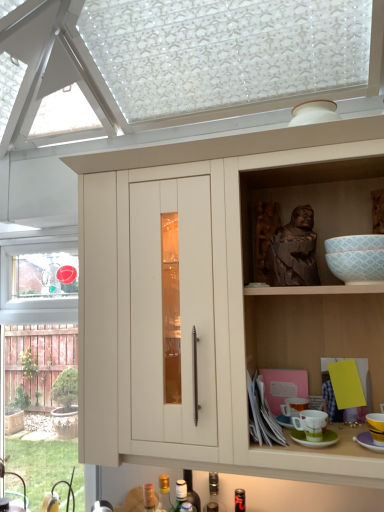
Question: Is yellow matte cup at lower right, the 2th tableware when ordered from left to right, positioned in front of matte ceramic mug at lower right, marked as the first tableware in a left-to-right arrangement?

Choices:
 (A) no
 (B) yes

Answer: (B)

Question: Is yellow matte cup at lower right, the 2th tableware when ordered from left to right, far from matte ceramic mug at lower right, marked as the first tableware in a left-to-right arrangement?

Choices:
 (A) yes
 (B) no

Answer: (B)

Question: Would you say matte ceramic mug at lower right, marked as the first tableware in a left-to-right arrangement, is part of yellow matte cup at lower right, positioned as the first tableware in right-to-left order,'s contents?

Choices:
 (A) yes
 (B) no

Answer: (B)

Question: Considering the relative sizes of yellow matte cup at lower right, positioned as the first tableware in right-to-left order, and matte ceramic mug at lower right, marked as the first tableware in a left-to-right arrangement, in the image provided, is yellow matte cup at lower right, positioned as the first tableware in right-to-left order, thinner than matte ceramic mug at lower right, marked as the first tableware in a left-to-right arrangement,?

Choices:
 (A) yes
 (B) no

Answer: (B)

Question: Does yellow matte cup at lower right, the 2th tableware when ordered from left to right, have a greater width compared to matte ceramic mug at lower right, marked as the first tableware in a left-to-right arrangement?

Choices:
 (A) yes
 (B) no

Answer: (A)

Question: Is yellow matte cup at lower right, the 2th tableware when ordered from left to right, behind matte ceramic mug at lower right, marked as the first tableware in a left-to-right arrangement?

Choices:
 (A) no
 (B) yes

Answer: (A)

Question: Is green matte saucer at lower right, arranged as the second saucer when viewed from the left, bigger than matte wood cabinet at center?

Choices:
 (A) no
 (B) yes

Answer: (A)

Question: Is green matte saucer at lower right, positioned as the first saucer in right-to-left order, further to the viewer compared to matte wood cabinet at center?

Choices:
 (A) yes
 (B) no

Answer: (A)

Question: From the image's perspective, is green matte saucer at lower right, arranged as the second saucer when viewed from the left, below matte wood cabinet at center?

Choices:
 (A) yes
 (B) no

Answer: (A)

Question: Does green matte saucer at lower right, positioned as the first saucer in right-to-left order, contain matte wood cabinet at center?

Choices:
 (A) no
 (B) yes

Answer: (A)

Question: From the image's perspective, does green matte saucer at lower right, arranged as the second saucer when viewed from the left, appear higher than matte wood cabinet at center?

Choices:
 (A) no
 (B) yes

Answer: (A)

Question: Considering the relative sizes of green matte saucer at lower right, positioned as the first saucer in right-to-left order, and matte wood cabinet at center in the image provided, is green matte saucer at lower right, positioned as the first saucer in right-to-left order, taller than matte wood cabinet at center?

Choices:
 (A) yes
 (B) no

Answer: (B)

Question: Can you confirm if translucent glass bottle at lower center, the 4th bottle in the right-to-left sequence, is bigger than brown wooden statue at upper right?

Choices:
 (A) no
 (B) yes

Answer: (A)